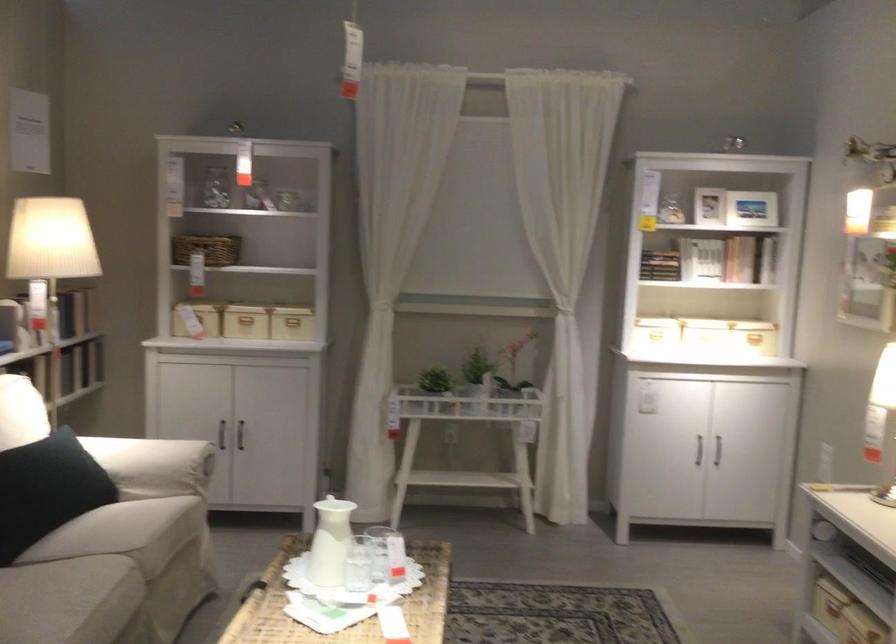
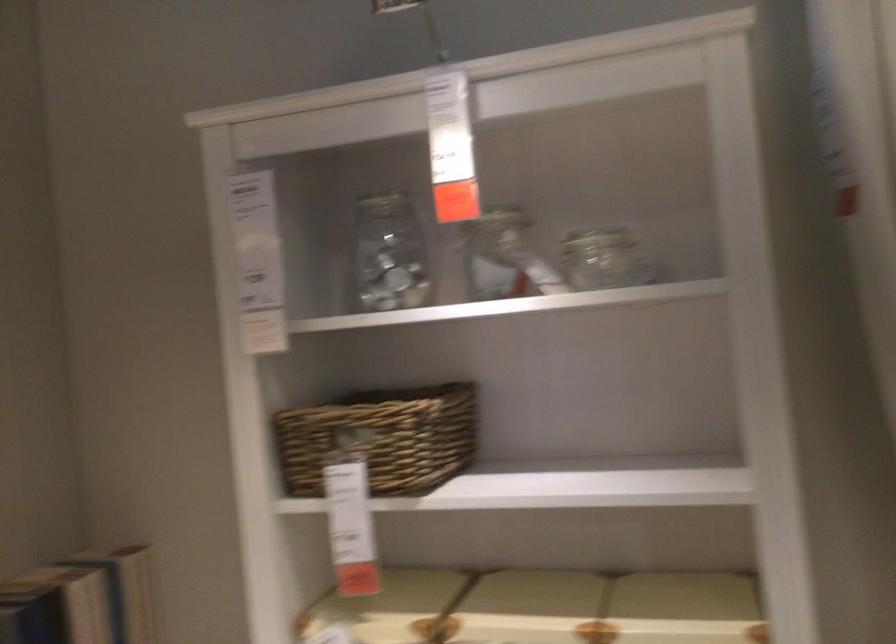
Question: What movement of the cameraman would produce the second image?

Choices:
 (A) Left
 (B) Right
 (C) Forward
 (D) Backward

Answer: (C)